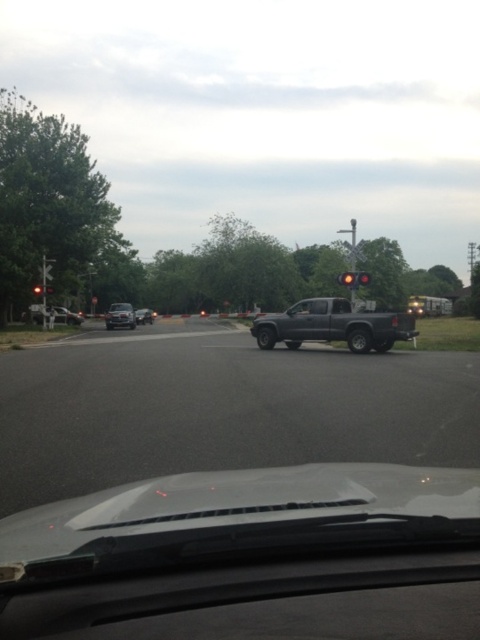
You are driving a vehicle and see the shiny silver sedan at left in your rearview mirror. Based on its position, can you estimate whether it is behind or ahead of your current position?

The shiny silver sedan at left is located at point (x=120, y=316), which suggests it is positioned ahead of your current vehicle since it appears in the rearview mirror.

You are a driver in a shiny silver sedan at left. You want to take a photo of the railroad crossing signals using a camera placed at the current position. Is the distance between you and the camera sufficient to capture the entire railroad crossing signals in one frame?

The shiny silver sedan at left and camera are 149.82 feet apart from each other. This distance is likely sufficient to capture the entire railroad crossing signals in one frame, as 149.82 feet provides enough space for the camera to encompass the signals within its field of view.